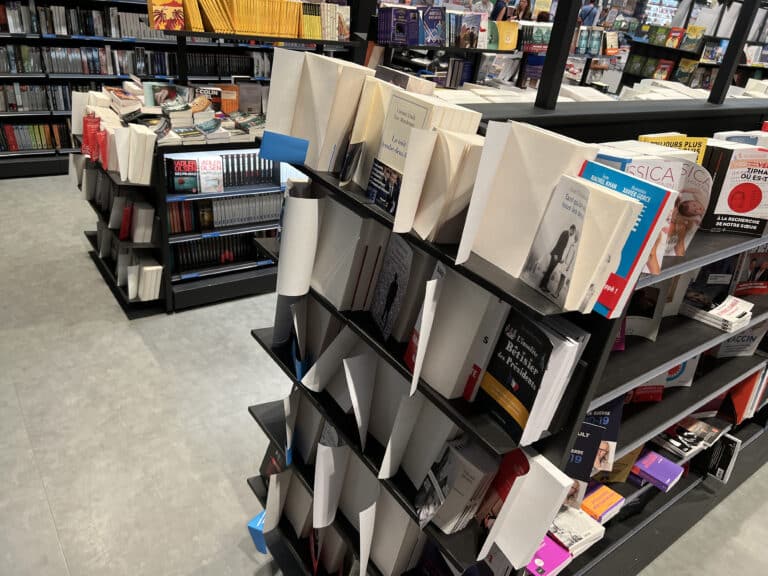
This screenshot has width=768, height=576. I want to click on black book cover, so click(187, 175).